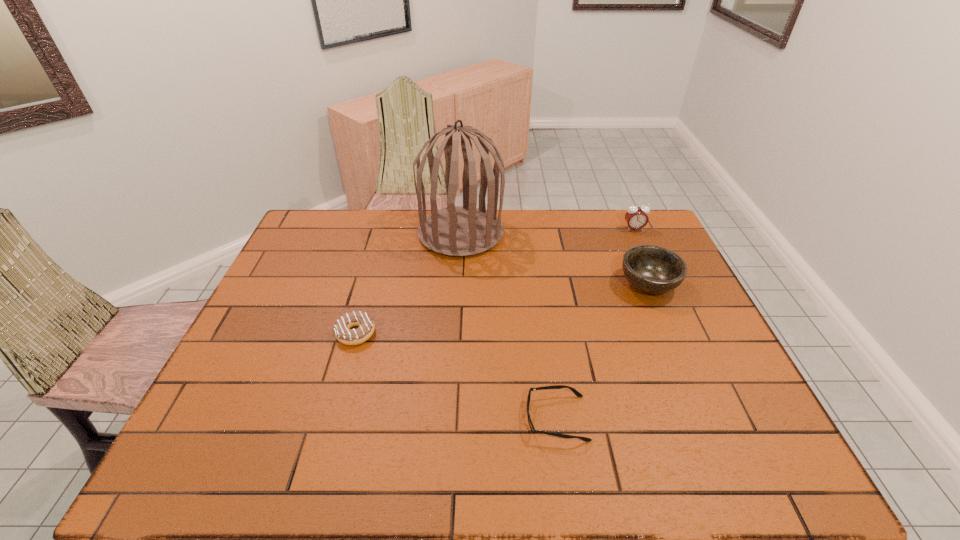
Find the location of a particular element. The width and height of the screenshot is (960, 540). the tallest object is located at coordinates (459, 231).

Identify the location of the fourth object from right to left. [459, 231].

Locate an element on the screen. The image size is (960, 540). the second tallest object is located at coordinates (636, 217).

At what (x,y) coordinates should I click in order to perform the action: click on bowl. Please return your answer as a coordinate pair (x, y). Image resolution: width=960 pixels, height=540 pixels. Looking at the image, I should click on (652, 269).

The height and width of the screenshot is (540, 960). Identify the location of the third farthest object. (x=652, y=269).

Locate an element on the screen. The height and width of the screenshot is (540, 960). doughnut is located at coordinates (343, 333).

In order to click on the fourth farthest object in this screenshot , I will do `click(343, 333)`.

The image size is (960, 540). What are the coordinates of `spectacles` in the screenshot? It's located at (573, 390).

The width and height of the screenshot is (960, 540). What are the coordinates of `the nearest object` in the screenshot? It's located at (573, 390).

The image size is (960, 540). What are the coordinates of `free space located on the left of the fourth object from right to left` in the screenshot? It's located at (372, 233).